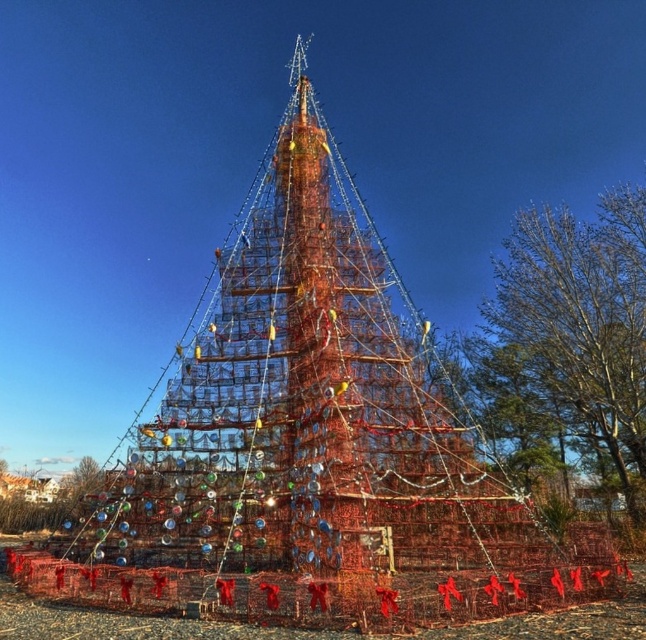
Question: Is metallic wireframe structure at center wider than green leafy tree at right?

Choices:
 (A) yes
 (B) no

Answer: (A)

Question: Which object is farther from the camera taking this photo?

Choices:
 (A) metallic wireframe structure at center
 (B) green leafy tree at right

Answer: (B)

Question: Which point is closer to the camera?

Choices:
 (A) green leafy tree at right
 (B) metallic wireframe structure at center

Answer: (B)

Question: Is the position of metallic wireframe structure at center more distant than that of green leafy tree at right?

Choices:
 (A) yes
 (B) no

Answer: (B)

Question: Can you confirm if metallic wireframe structure at center is positioned below green leafy tree at right?

Choices:
 (A) yes
 (B) no

Answer: (B)

Question: Which point appears closest to the camera in this image?

Choices:
 (A) (492, 584)
 (B) (517, 232)

Answer: (A)